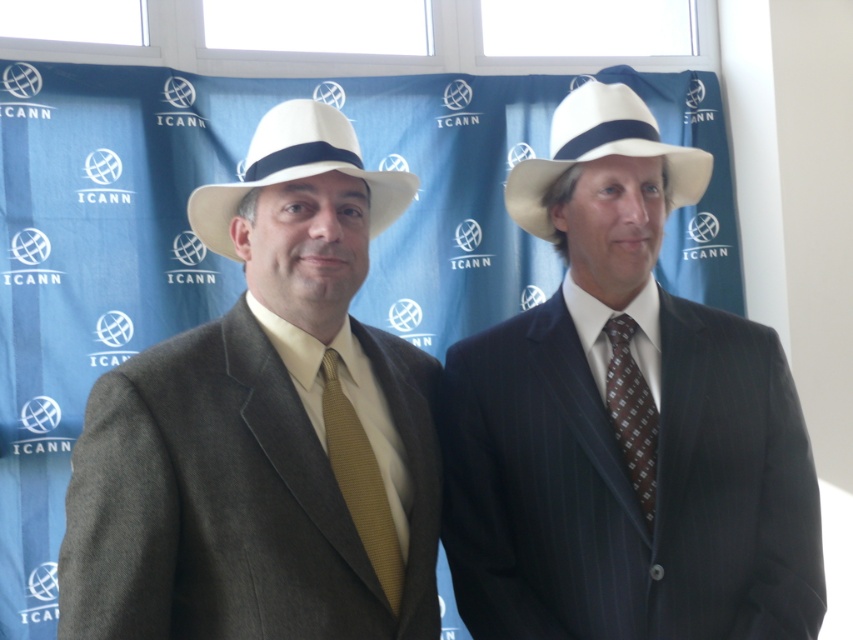
Image resolution: width=853 pixels, height=640 pixels. I want to click on matte black suit at center, so click(624, 422).

Who is positioned more to the right, matte black suit at center or white felt fedora at upper right?

white felt fedora at upper right

This screenshot has width=853, height=640. I want to click on matte black suit at center, so click(x=624, y=422).

Who is more forward, (635, 451) or (630, 442)?

Point (635, 451)

Which of these two, matte black suit at center or brown woven tie at center, stands taller?

matte black suit at center is taller.

Which is behind, point (576, 148) or point (651, 500)?

The point (576, 148) is more distant.

Find the location of a particular element. This screenshot has height=640, width=853. matte black suit at center is located at coordinates (624, 422).

Between point (202, 234) and point (548, 241), which one is positioned in front?

Positioned in front is point (202, 234).

Is point (258, 180) less distant than point (537, 208)?

Yes, it is in front of point (537, 208).

Identify the location of white felt fedora at center. (297, 170).